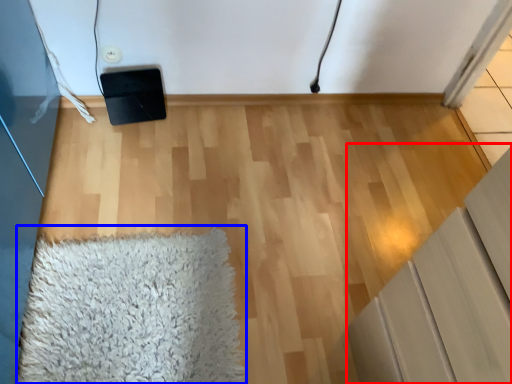
Question: Which point is closer to the camera, furniture (highlighted by a red box) or mat (highlighted by a blue box)?

Choices:
 (A) furniture
 (B) mat

Answer: (A)